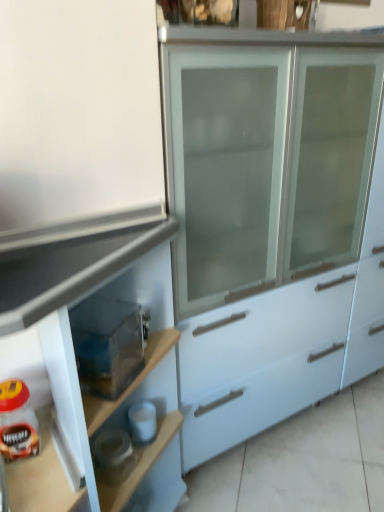
Question: Should I look upward or downward to see transparent plastic container at lower left?

Choices:
 (A) down
 (B) up

Answer: (A)

Question: Does transparent plastic container at lower left have a larger size compared to matte white cabinet at center?

Choices:
 (A) yes
 (B) no

Answer: (B)

Question: From the image's perspective, is transparent plastic container at lower left over matte white cabinet at center?

Choices:
 (A) no
 (B) yes

Answer: (B)

Question: Is transparent plastic container at lower left to the right of matte white cabinet at center from the viewer's perspective?

Choices:
 (A) no
 (B) yes

Answer: (B)

Question: Considering the relative sizes of transparent plastic container at lower left and matte white cabinet at center in the image provided, is transparent plastic container at lower left shorter than matte white cabinet at center?

Choices:
 (A) yes
 (B) no

Answer: (A)

Question: Is transparent plastic container at lower left aimed at matte white cabinet at center?

Choices:
 (A) yes
 (B) no

Answer: (A)

Question: Is transparent plastic container at lower left at the left side of matte white cabinet at center?

Choices:
 (A) no
 (B) yes

Answer: (A)

Question: Is there a large distance between transparent plastic container at lower left and matte glass jar of coffee at lower left?

Choices:
 (A) no
 (B) yes

Answer: (A)

Question: Is transparent plastic container at lower left next to matte glass jar of coffee at lower left?

Choices:
 (A) no
 (B) yes

Answer: (A)

Question: Is transparent plastic container at lower left shorter than matte glass jar of coffee at lower left?

Choices:
 (A) yes
 (B) no

Answer: (B)

Question: Is transparent plastic container at lower left thinner than matte glass jar of coffee at lower left?

Choices:
 (A) no
 (B) yes

Answer: (A)

Question: From the image's perspective, is transparent plastic container at lower left on top of matte glass jar of coffee at lower left?

Choices:
 (A) no
 (B) yes

Answer: (B)

Question: Considering the relative positions of transparent plastic container at lower left and matte glass jar of coffee at lower left in the image provided, is transparent plastic container at lower left to the left of matte glass jar of coffee at lower left from the viewer's perspective?

Choices:
 (A) no
 (B) yes

Answer: (A)

Question: From a real-world perspective, is matte white cabinet at center below matte glass jar of coffee at lower left?

Choices:
 (A) yes
 (B) no

Answer: (A)